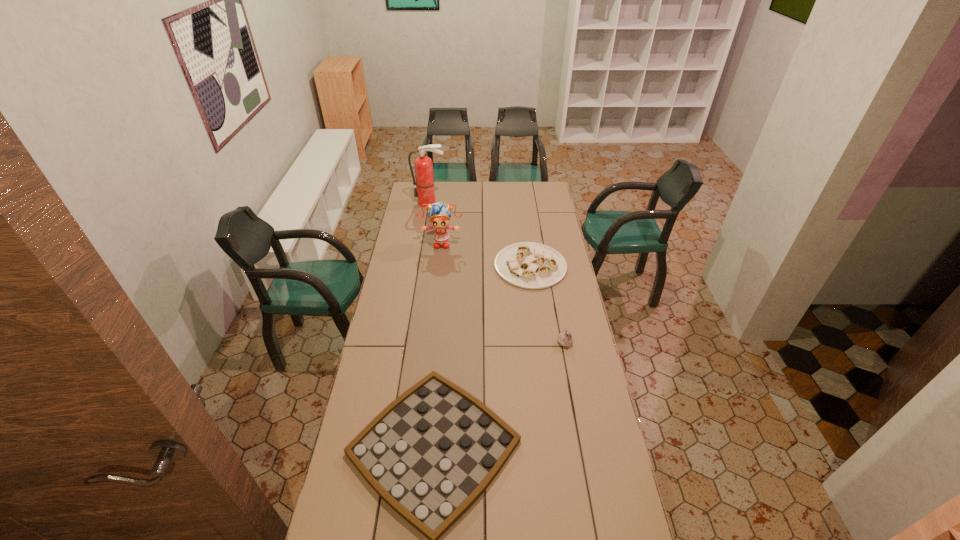
What are the coordinates of `vacant area in the image that satisfies the following two spatial constraints: 1. with the handle and hose on the fire extinguisher; 2. on the left side of the third tallest object` in the screenshot? It's located at (407, 342).